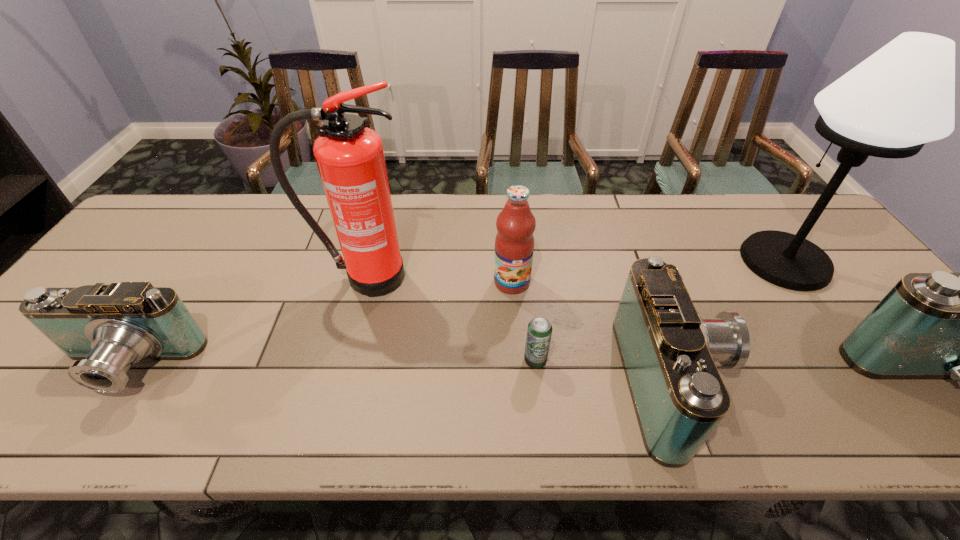
To achieve uniform spacing by inserting another camcorder among them, please point to a free space for this new camcorder. Please provide its 2D coordinates. Your answer should be formatted as a tuple, i.e. [(x, y)], where the tuple contains the x and y coordinates of a point satisfying the conditions above.

[(397, 374)]